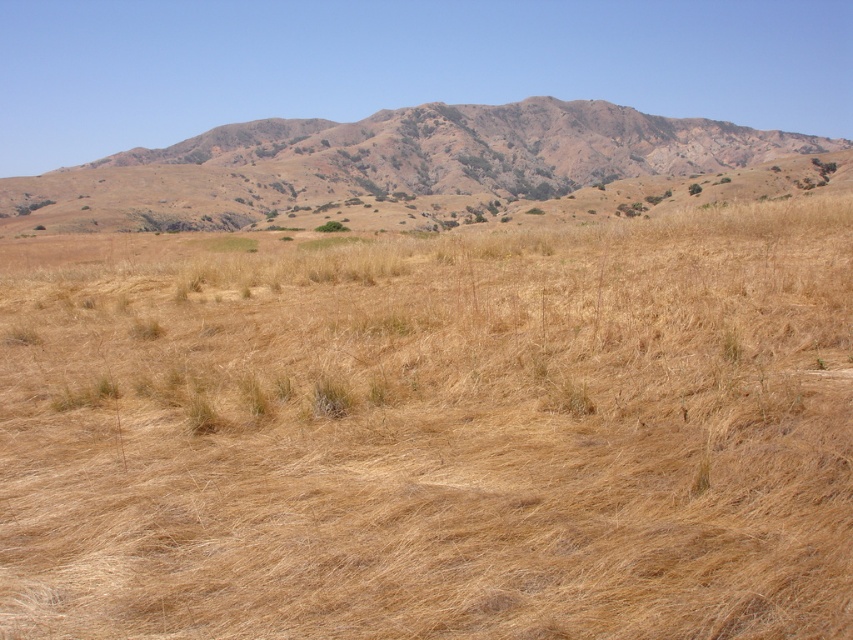
You are standing at the point with coordinates point (165, 547) and want to walk towards the point with coordinates point (480, 152). Which direction should you face to walk directly towards it?

You should face northwest to walk directly towards point (480, 152) from point (165, 547).